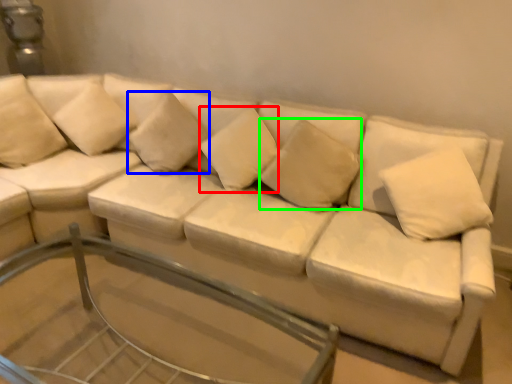
Question: Estimate the real-world distances between objects in this image. Which object is farther from pillow (highlighted by a red box), pillow (highlighted by a blue box) or pillow (highlighted by a green box)?

Choices:
 (A) pillow
 (B) pillow

Answer: (A)